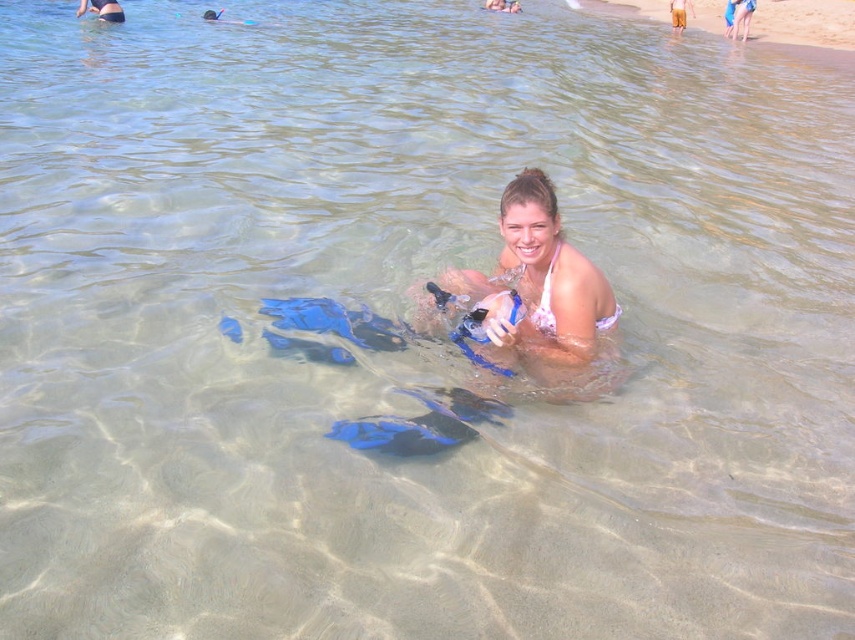
You are a photographer at the beach and want to capture a photo of the white bikini at center and the pink fabric bikini at upper center. Which bikini is positioned higher in the frame?

Answer: The white bikini at center is much taller as the pink fabric bikini at upper center, so the white bikini at center is positioned higher in the frame.

You are a photographer trying to capture both the white bikini at center and the pink fabric bikini at upper center in the same frame. Based on their positions, which bikini should you focus on first to ensure both are in the shot?

The white bikini at center is to the right of the pink fabric bikini at upper center, so you should focus on the pink fabric bikini at upper center first to ensure both are in the shot.